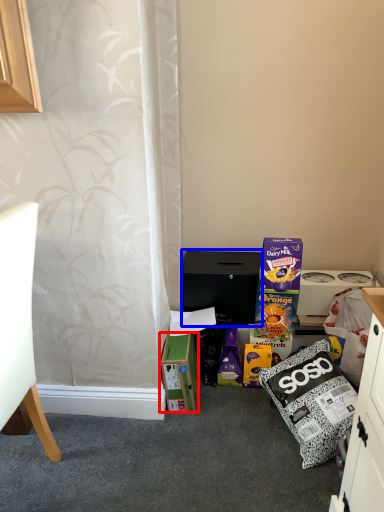
Question: Which object is closer to the camera taking this photo, box (highlighted by a red box) or cabinetry (highlighted by a blue box)?

Choices:
 (A) box
 (B) cabinetry

Answer: (A)